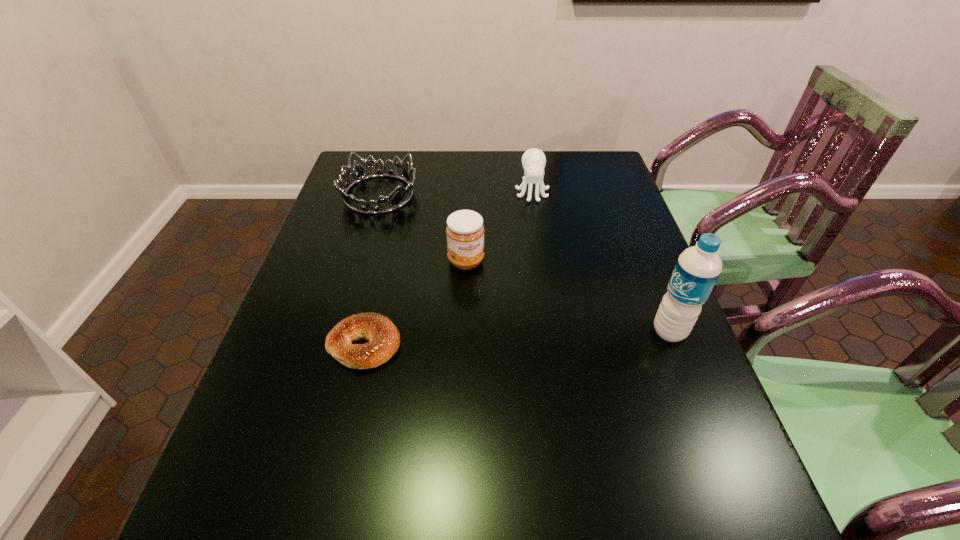
Where is `free region at the far left corner of the desktop`? Image resolution: width=960 pixels, height=540 pixels. free region at the far left corner of the desktop is located at coordinates (391, 163).

Identify the location of free space at the near left corner of the desktop. (284, 443).

Find the location of a particular element. vacant space at the far right corner is located at coordinates (611, 167).

Identify the location of free space at the near right corner. The width and height of the screenshot is (960, 540). (666, 453).

Image resolution: width=960 pixels, height=540 pixels. What are the coordinates of `free space between the shortest object and the third object from left to right` in the screenshot? It's located at (416, 303).

This screenshot has height=540, width=960. Identify the location of vacant space in between the tallest object and the octopus. (601, 262).

At what (x,y) coordinates should I click in order to perform the action: click on vacant point located between the fourth object from left to right and the rightmost object. Please return your answer as a coordinate pair (x, y). The width and height of the screenshot is (960, 540). Looking at the image, I should click on (601, 262).

Image resolution: width=960 pixels, height=540 pixels. What are the coordinates of `vacant area that lies between the rightmost object and the tiara` in the screenshot? It's located at (524, 263).

Identify the location of vacant space that is in between the jam and the shortest object. This screenshot has height=540, width=960. (416, 303).

Locate an element on the screen. This screenshot has width=960, height=540. free point between the rightmost object and the shortest object is located at coordinates (516, 338).